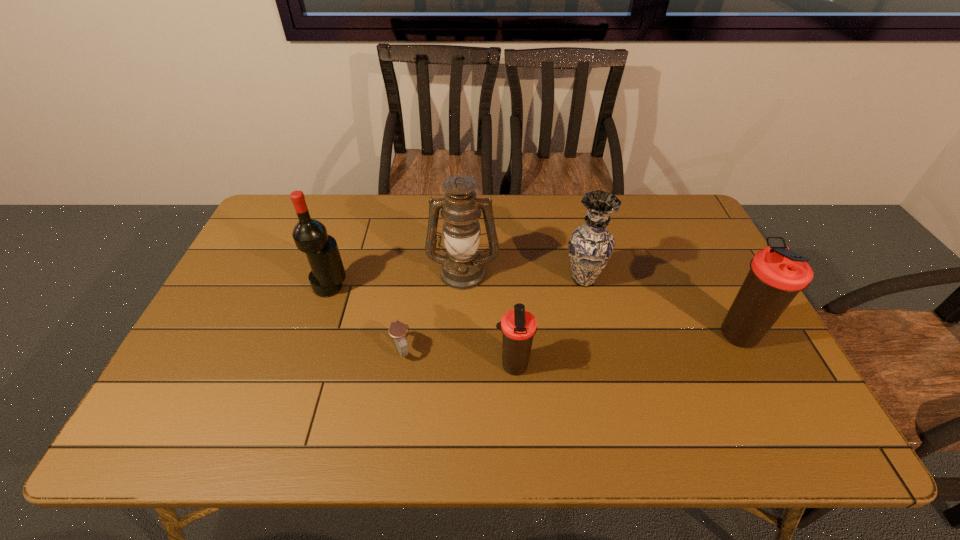
Locate an element on the screen. The width and height of the screenshot is (960, 540). vacant area at the right edge is located at coordinates (728, 287).

Locate an element on the screen. The height and width of the screenshot is (540, 960). vacant space at the far left corner is located at coordinates (310, 204).

Identify the location of vacant region at the near left corner. (192, 377).

Where is `blank region between the second shortest object and the oil lamp`? Image resolution: width=960 pixels, height=540 pixels. blank region between the second shortest object and the oil lamp is located at coordinates (488, 319).

The width and height of the screenshot is (960, 540). What are the coordinates of `free spot between the oil lamp and the second object from right to left` in the screenshot? It's located at (523, 275).

Find the location of a particular element. free spot between the fifth object from right to left and the right thermos bottle is located at coordinates (571, 342).

Locate an element on the screen. This screenshot has width=960, height=540. free spot between the left thermos bottle and the taller thermos bottle is located at coordinates (627, 350).

Image resolution: width=960 pixels, height=540 pixels. I want to click on free space that is in between the second object from left to right and the left thermos bottle, so click(x=458, y=358).

Identify the location of vacant space that is in between the wine bottle and the shortest object. This screenshot has width=960, height=540. (367, 319).

The image size is (960, 540). I want to click on vacant space that's between the right thermos bottle and the fifth object from right to left, so click(x=571, y=342).